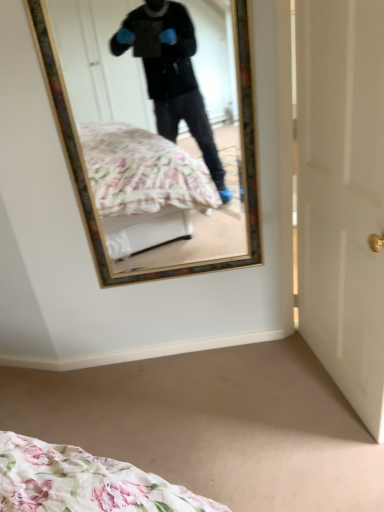
Question: Is point (311, 64) closer or farther from the camera than point (206, 128)?

Choices:
 (A) farther
 (B) closer

Answer: (B)

Question: From a real-world perspective, relative to wooden-framed mirror at upper center, is white glossy door at right vertically above or below?

Choices:
 (A) below
 (B) above

Answer: (A)

Question: In terms of width, does white glossy door at right look wider or thinner when compared to wooden-framed mirror at upper center?

Choices:
 (A) thin
 (B) wide

Answer: (B)

Question: In terms of width, does wooden-framed mirror at upper center look wider or thinner when compared to white glossy door at right?

Choices:
 (A) thin
 (B) wide

Answer: (A)

Question: Is wooden-framed mirror at upper center bigger or smaller than white glossy door at right?

Choices:
 (A) small
 (B) big

Answer: (A)

Question: Is point (132, 111) positioned closer to the camera than point (322, 312)?

Choices:
 (A) closer
 (B) farther

Answer: (A)

Question: Is wooden-framed mirror at upper center inside the boundaries of white glossy door at right, or outside?

Choices:
 (A) inside
 (B) outside

Answer: (B)